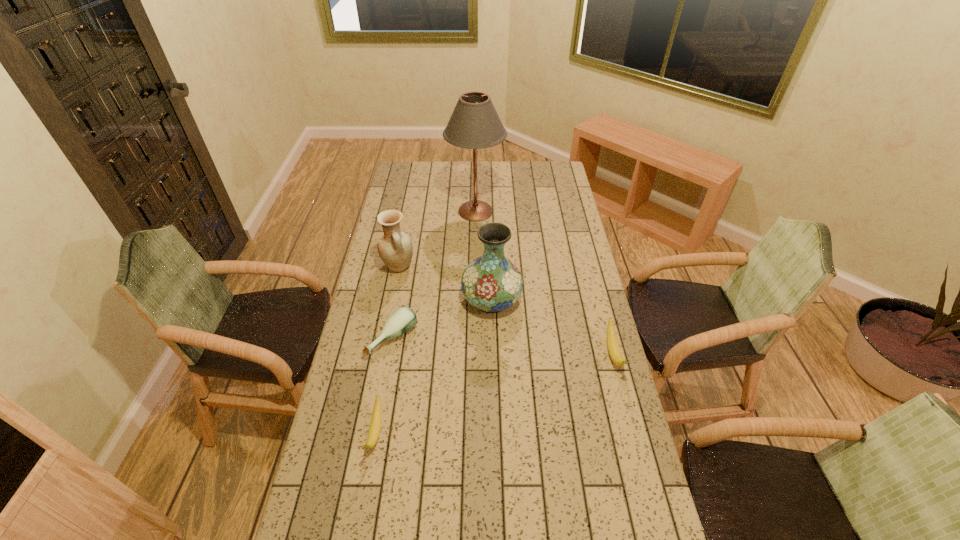
To ensure equal spacing by inserting another banana among them, please point out a vacant spot for this new banana. Please provide its 2D coordinates. Your answer should be formatted as a tuple, i.e. [(x, y)], where the tuple contains the x and y coordinates of a point satisfying the conditions above.

[(503, 390)]